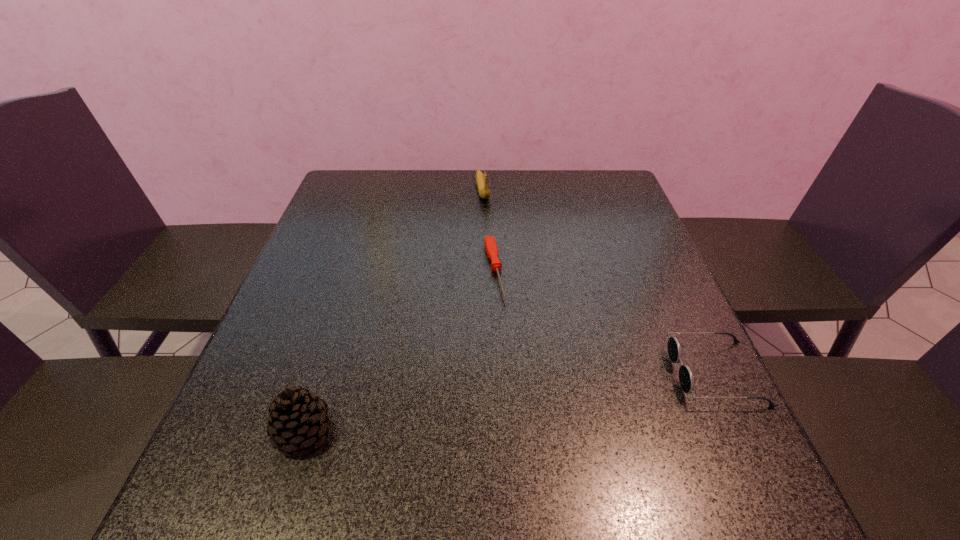
The height and width of the screenshot is (540, 960). I want to click on object that is at the right edge, so click(x=686, y=378).

At what (x,y) coordinates should I click in order to perform the action: click on object that is at the near left corner. Please return your answer as a coordinate pair (x, y). Looking at the image, I should click on (298, 419).

Image resolution: width=960 pixels, height=540 pixels. I want to click on object that is at the near right corner, so click(x=686, y=378).

Where is `vacant region at the far edge of the desktop`? vacant region at the far edge of the desktop is located at coordinates (549, 201).

Locate an element on the screen. free space at the near edge of the desktop is located at coordinates pos(581,451).

Locate an element on the screen. The height and width of the screenshot is (540, 960). vacant space at the left edge of the desktop is located at coordinates (324, 332).

In the image, there is a desktop. Identify the location of vacant space at the right edge. (617, 323).

You are a GUI agent. You are given a task and a screenshot of the screen. Output one action in this format:
    pyautogui.click(x=<x>, y=<y>)
    Task: Click on the vacant space at the far left corner of the desktop
    This screenshot has height=540, width=960.
    Given the screenshot: What is the action you would take?
    pyautogui.click(x=327, y=210)

Find the location of `vacant area at the far right corner of the desktop`. vacant area at the far right corner of the desktop is located at coordinates (614, 197).

Image resolution: width=960 pixels, height=540 pixels. I want to click on empty location between the screwdriver and the pinecone, so click(399, 351).